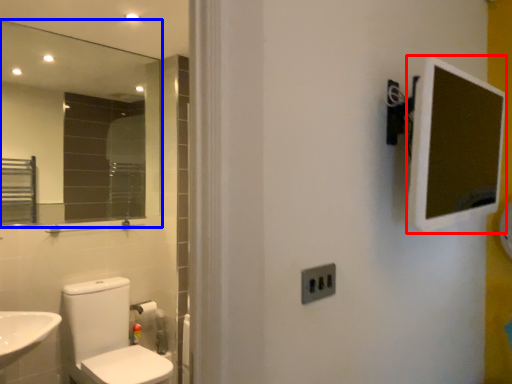
Question: Which object is closer to the camera taking this photo, medicine cabinet (highlighted by a red box) or mirror (highlighted by a blue box)?

Choices:
 (A) medicine cabinet
 (B) mirror

Answer: (A)